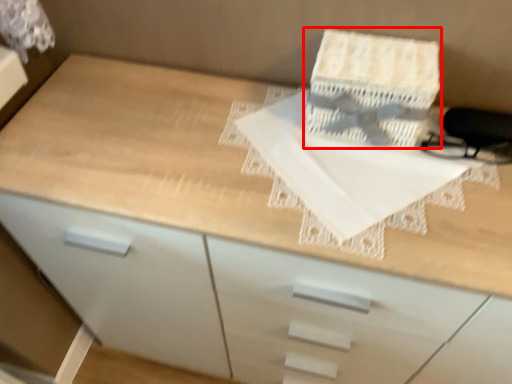
Question: Considering the relative positions of cardboard box (annotated by the red box) and sheet in the image provided, where is cardboard box (annotated by the red box) located with respect to the staircase?

Choices:
 (A) right
 (B) left

Answer: (A)